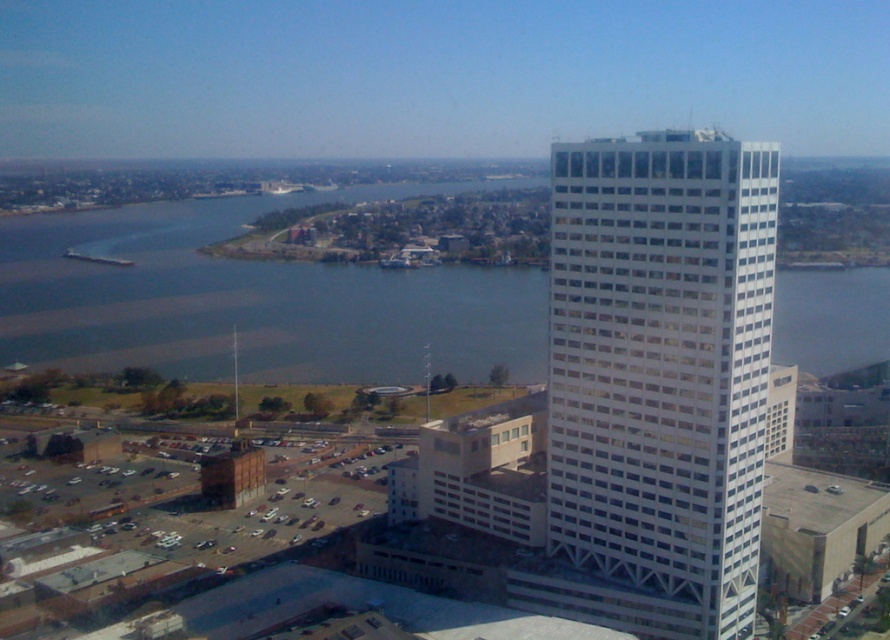
You are standing at the waterfront looking towards the city. Which object, the white glass building at upper right or the blue water at center, is closer to you?

The white glass building at upper right is closer to the viewer than the blue water at center.

From the picture: You are an architect reviewing a city layout. You need to determine if the white glass building at upper right can be seen from the blue water at center. Based on their heights, can you confirm visibility?

The white glass building at upper right has a lesser height compared to blue water at center, so it is possible that the building might be obscured or not fully visible from the water depending on the terrain and surrounding structures. However, since the building is in the foreground and the water is at center, the building could still be visible if there are no obstructions.

You are standing at the viewpoint of the camera and want to walk to one of the two points in the image. Which point, point (565, 486) or point (50, 310), is closer to you?

Point (565, 486) is closer to the camera than point (50, 310).